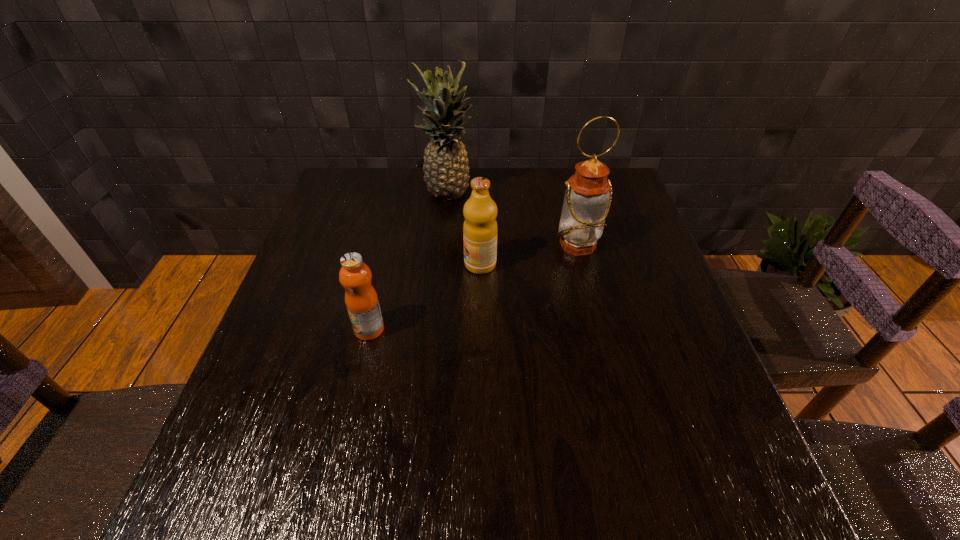
The image size is (960, 540). I want to click on free region located on the front of the nearest object, so click(x=356, y=386).

Image resolution: width=960 pixels, height=540 pixels. I want to click on object located at the far edge, so click(x=446, y=171).

Locate an element on the screen. Image resolution: width=960 pixels, height=540 pixels. object that is positioned at the right edge is located at coordinates (588, 194).

In the image, there is a desktop. Identify the location of vacant space at the far edge. (540, 190).

This screenshot has height=540, width=960. In order to click on vacant space at the near edge of the desktop in this screenshot , I will do `click(625, 519)`.

Where is `free region at the left edge of the desktop`? free region at the left edge of the desktop is located at coordinates (340, 228).

I want to click on vacant space at the right edge, so click(706, 409).

The image size is (960, 540). In the image, there is a desktop. In order to click on free space at the far left corner in this screenshot , I will do `click(383, 186)`.

Identify the location of vacant region at the near left corner of the desktop. (281, 488).

At what (x,y) coordinates should I click in order to perform the action: click on unoccupied area between the farthest object and the shortest object. Please return your answer as a coordinate pair (x, y). Looking at the image, I should click on (408, 262).